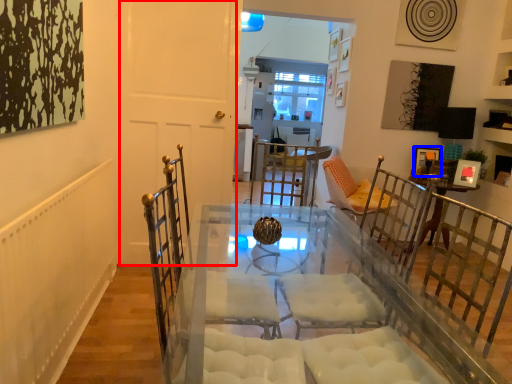
Question: Among these objects, which one is nearest to the camera, door (highlighted by a red box) or picture frame (highlighted by a blue box)?

Choices:
 (A) door
 (B) picture frame

Answer: (A)